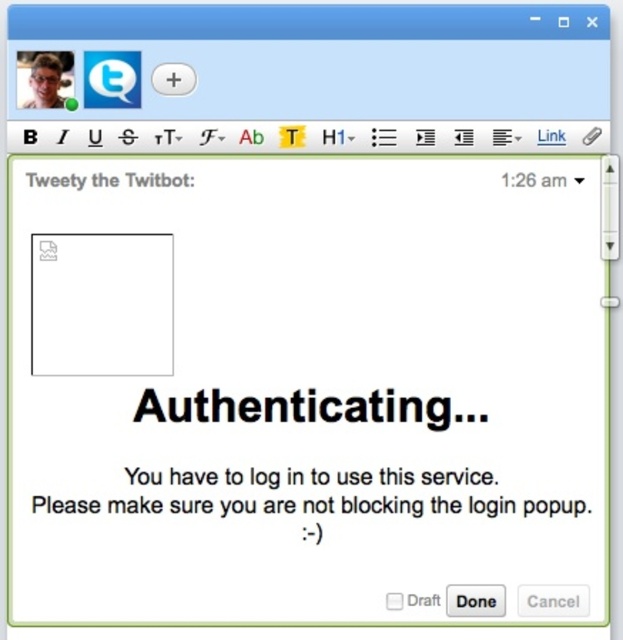
Question: Does black text at center appear over black matte text at center?

Choices:
 (A) yes
 (B) no

Answer: (A)

Question: Based on their relative distances, which object is nearer to the black text at upper center?

Choices:
 (A) black text at center
 (B) white matte square at upper left

Answer: (B)

Question: Is black text at center in front of black matte text at center?

Choices:
 (A) yes
 (B) no

Answer: (B)

Question: Is black text at center below black matte text at center?

Choices:
 (A) no
 (B) yes

Answer: (A)

Question: Which point appears closest to the camera in this image?

Choices:
 (A) (222, 403)
 (B) (482, 477)

Answer: (B)

Question: Which object appears farthest from the camera in this image?

Choices:
 (A) black text at center
 (B) black matte text at center

Answer: (A)